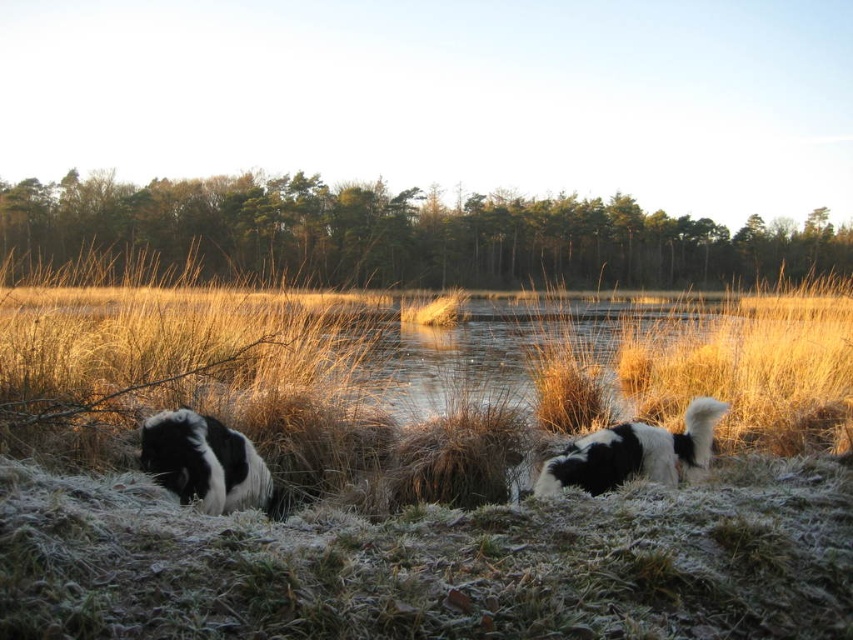
Question: Does frosted grass at center have a greater width compared to black and white fur dog at lower right?

Choices:
 (A) no
 (B) yes

Answer: (B)

Question: Does frosted grass at center have a larger size compared to black and white fur dog at lower left?

Choices:
 (A) yes
 (B) no

Answer: (A)

Question: Which of the following is the farthest from the observer?

Choices:
 (A) black and white fur dog at lower right
 (B) frosted grass at center
 (C) black and white fur dog at lower left

Answer: (C)

Question: Is black and white fur dog at lower left wider than black and white fur dog at lower right?

Choices:
 (A) yes
 (B) no

Answer: (B)

Question: Which object appears closest to the camera in this image?

Choices:
 (A) black and white fur dog at lower left
 (B) black and white fur dog at lower right

Answer: (B)

Question: Which object is closer to the camera taking this photo?

Choices:
 (A) black and white fur dog at lower right
 (B) frosted grass at center

Answer: (B)